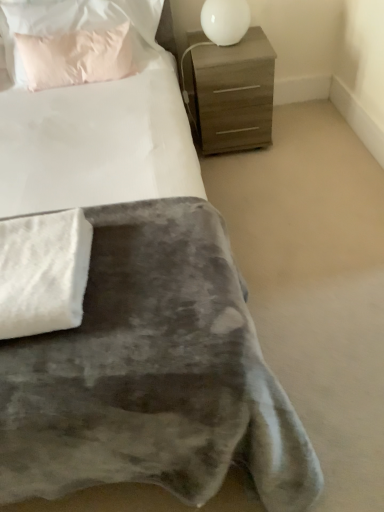
Locate an element on the screen. This screenshot has width=384, height=512. free space in front of matte brown chest of drawers at upper right is located at coordinates (251, 173).